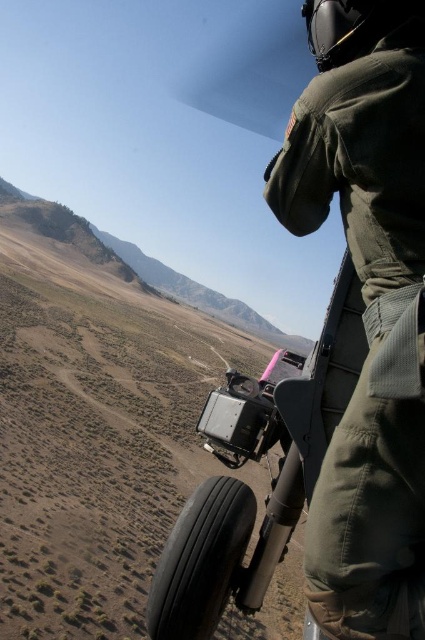
You are a passenger in the helicopter and need to determine which object is wider from your viewpoint. Which one is wider between the green fabric uniform at upper right and the black rubber tire at lower center?

The green fabric uniform at upper right is wider than the black rubber tire at lower center according to the description.

You are a pilot flying a helicopter and need to land in a safe area. You see two points marked on your map as point (340, 449) and point (150, 589). According to the scene description, which point is closer to the helicopter when looking straight ahead?

Point (340, 449) is in front of point (150, 589), so it is closer to the helicopter when looking straight ahead.

Looking at this image, you are a passenger in the helicopter and notice the green fabric uniform at upper right and the black rubber tire at lower center. Which object is positioned higher from the ground?

The green fabric uniform at upper right is much taller than the black rubber tire at lower center, so it is positioned higher from the ground.